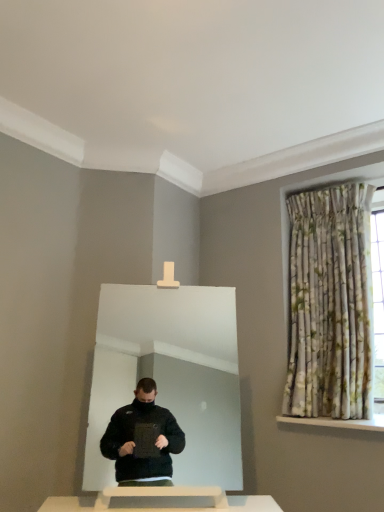
Question: Should I look upward or downward to see white glossy mirror at center?

Choices:
 (A) up
 (B) down

Answer: (B)